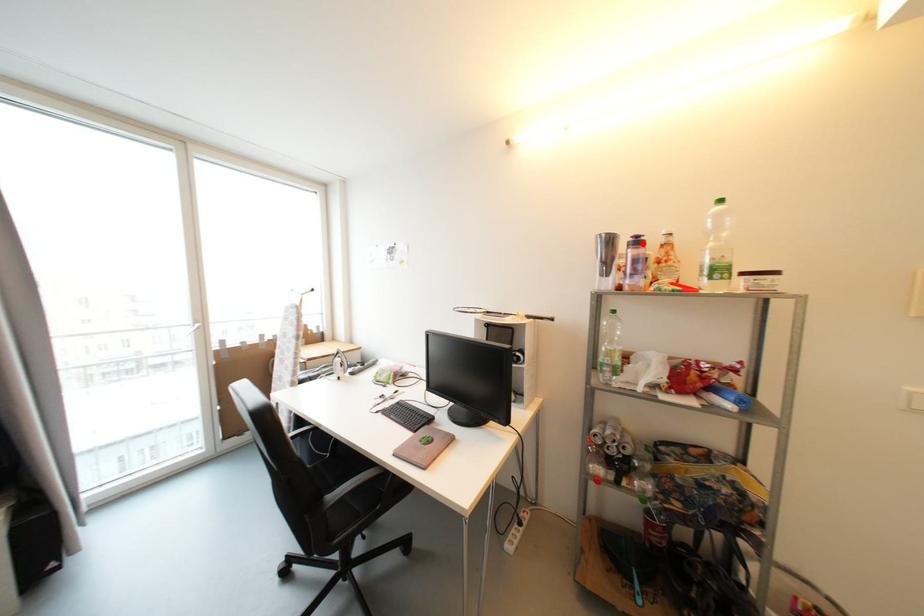
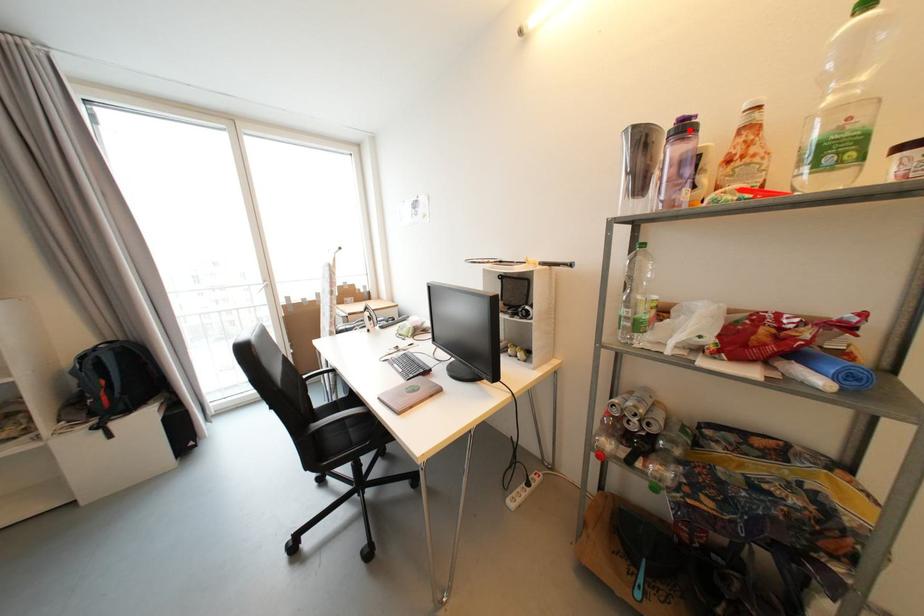
I am providing you with two images of the same scene from different viewpoints. A red point is marked on the first image and another point is marked on the second image. Is the marked point in image1 the same physical position as the marked point in image2?

Yes